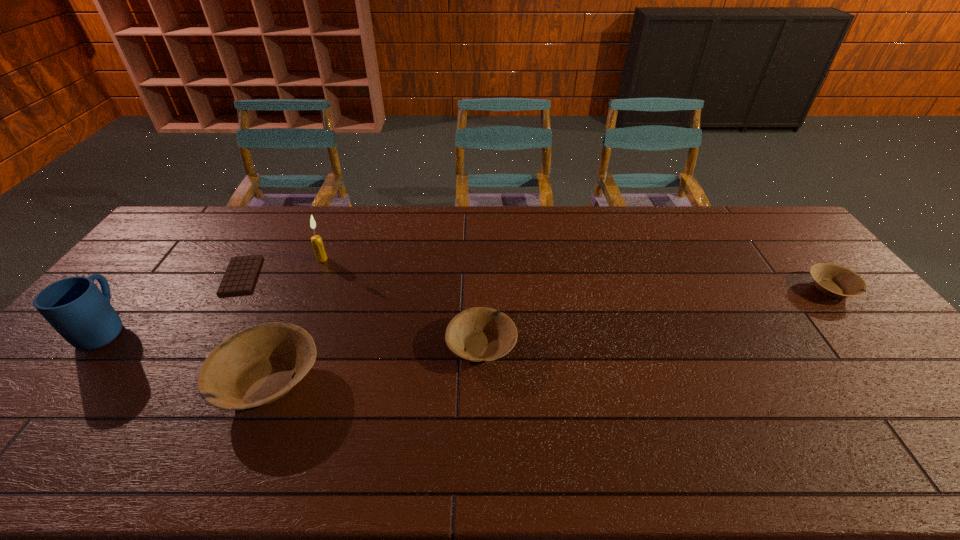
The image size is (960, 540). I want to click on vacant space that's between the chocolate bar and the rightmost bowl, so click(536, 282).

Where is `free space between the shortest object and the candle`? Image resolution: width=960 pixels, height=540 pixels. free space between the shortest object and the candle is located at coordinates (281, 267).

This screenshot has width=960, height=540. Find the location of `vacant area that lies between the second object from right to left and the tallest bowl`. vacant area that lies between the second object from right to left and the tallest bowl is located at coordinates (374, 363).

Locate an element on the screen. vacant point located between the candle and the mug is located at coordinates (x=214, y=294).

Identify which object is the second nearest to the tallest bowl. Please provide its 2D coordinates. Your answer should be formatted as a tuple, i.e. [(x, y)], where the tuple contains the x and y coordinates of a point satisfying the conditions above.

[(477, 334)]

Where is `object that is the fourth closest to the chocolate bar`? The height and width of the screenshot is (540, 960). object that is the fourth closest to the chocolate bar is located at coordinates (477, 334).

Identify which bowl is the second nearest to the mug. Please provide its 2D coordinates. Your answer should be formatted as a tuple, i.e. [(x, y)], where the tuple contains the x and y coordinates of a point satisfying the conditions above.

[(477, 334)]

Locate which bowl ranks third in proximity to the chocolate bar. Please provide its 2D coordinates. Your answer should be formatted as a tuple, i.e. [(x, y)], where the tuple contains the x and y coordinates of a point satisfying the conditions above.

[(833, 280)]

Identify the location of vacant space that satisfies the following two spatial constraints: 1. on the front side of the shortest object; 2. on the left side of the second tallest bowl. Image resolution: width=960 pixels, height=540 pixels. (198, 346).